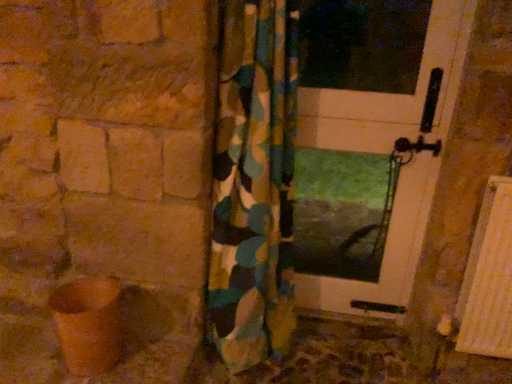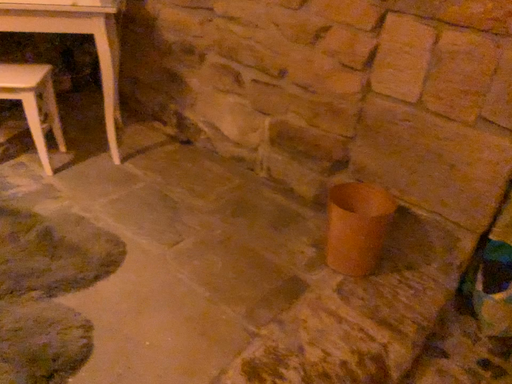
Question: How did the camera likely rotate when shooting the video?

Choices:
 (A) rotated left
 (B) rotated right

Answer: (A)